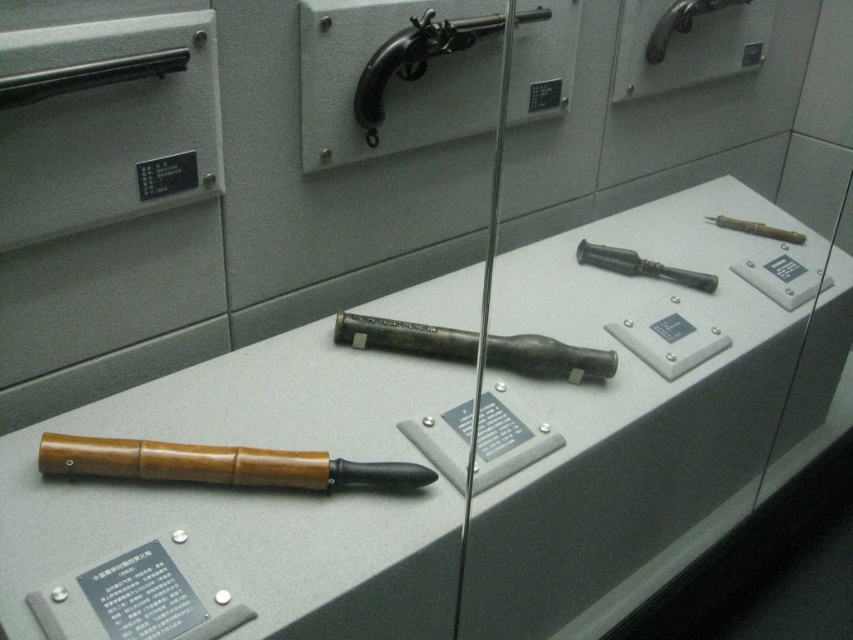
You are a museum security guard checking the display case. You notice the polished metal pistol at upper center and the matte silver pipe at upper center. Which object takes up more space in the display case?

The polished metal pistol at upper center takes up more space in the display case because it has a larger size compared to the matte silver pipe at upper center.

You are a security guard checking the museum layout. You need to ensure that the wooden handle knife at lower left is visible from the entrance. Given that the matte gray display case at center is blocking part of the view, is the knife still visible?

The matte gray display case at center is bigger than wooden handle knife at lower left, so it might block the view. However, since the knife is at lower left and the display case is centrally located, the knife could still be partially visible depending on the angle. But based on the description, the display case is larger, so it might obstruct the view. The answer is uncertain without more details.

Based on the coordinates provided, which object is located at point [413,60]?

The polished metal pistol at upper center is located at point [413,60].